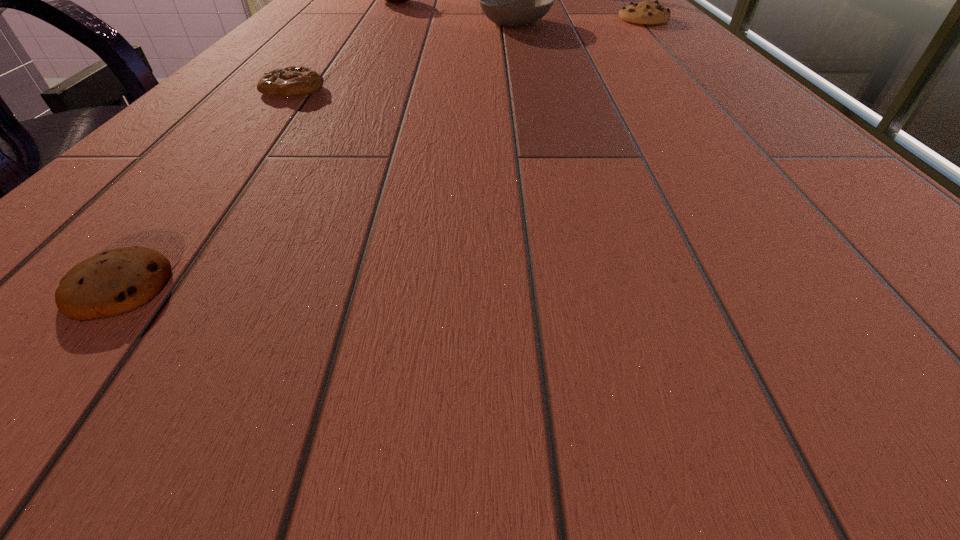
Point out which object is positioned as the nearest to the nearest cookie. Please provide its 2D coordinates. Your answer should be formatted as a tuple, i.e. [(x, y)], where the tuple contains the x and y coordinates of a point satisfying the conditions above.

[(292, 81)]

You are a GUI agent. You are given a task and a screenshot of the screen. Output one action in this format:
    pyautogui.click(x=<x>, y=<y>)
    Task: Click on the object that stands as the closest to the farthest cookie
    
    Given the screenshot: What is the action you would take?
    pyautogui.click(x=513, y=0)

Image resolution: width=960 pixels, height=540 pixels. In order to click on cookie that is the nearest to the second nearest cookie in this screenshot , I will do `click(118, 281)`.

Find the location of a particular element. cookie that is the second closest to the third tallest object is located at coordinates (118, 281).

You are a GUI agent. You are given a task and a screenshot of the screen. Output one action in this format:
    pyautogui.click(x=<x>, y=<y>)
    Task: Click on the free region that satisfies the following two spatial constraints: 1. on the back side of the tallest cookie; 2. on the right side of the fourth farthest object
    
    Given the screenshot: What is the action you would take?
    pyautogui.click(x=348, y=19)

Locate an element on the screen. The width and height of the screenshot is (960, 540). blank space that satisfies the following two spatial constraints: 1. on the back side of the bowl; 2. on the right side of the nearest cookie is located at coordinates (336, 24).

Where is `free location that satisfies the following two spatial constraints: 1. on the back side of the second object from right to left; 2. on the left side of the second farthest cookie`? The image size is (960, 540). free location that satisfies the following two spatial constraints: 1. on the back side of the second object from right to left; 2. on the left side of the second farthest cookie is located at coordinates (345, 24).